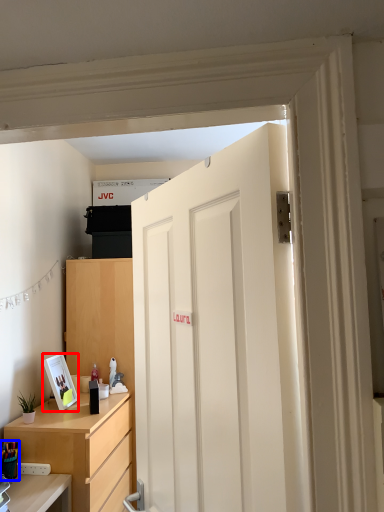
Question: Which object appears farthest to the camera in this image, picture frame (highlighted by a red box) or stationery (highlighted by a blue box)?

Choices:
 (A) picture frame
 (B) stationery

Answer: (A)